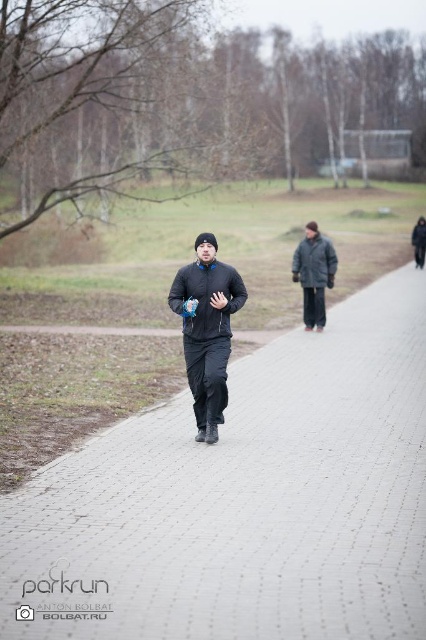
In the scene shown: Who is more forward, (x=383, y=316) or (x=301, y=260)?

Point (x=301, y=260) is in front.

Is gray brick pavement at center above dark gray woolen jacket at center?

No.

Describe the element at coordinates (244, 500) in the screenshot. I see `gray brick pavement at center` at that location.

Identify the location of gray brick pavement at center. This screenshot has height=640, width=426. [244, 500].

What are the coordinates of `matte black jacket at center` in the screenshot? It's located at (207, 330).

Who is positioned more to the right, gray brick pavement at center or matte black sweatshirt at center?

From the viewer's perspective, gray brick pavement at center appears more on the right side.

Does gray brick pavement at center come behind matte black sweatshirt at center?

No, gray brick pavement at center is in front of matte black sweatshirt at center.

Measure the distance between point [120,465] and camera.

A distance of 8.30 meters exists between point [120,465] and camera.

Locate an element on the screen. This screenshot has width=426, height=640. gray brick pavement at center is located at coordinates (244, 500).